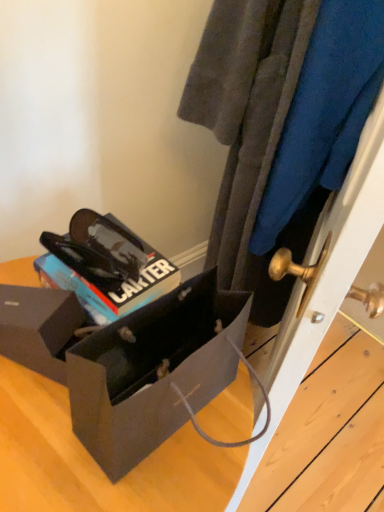
Question: In terms of size, does matte black box at lower left, which is counted as the first box, starting from the back, appear bigger or smaller than velvety blue sweater at center?

Choices:
 (A) small
 (B) big

Answer: (A)

Question: Which is correct: matte black box at lower left, positioned as the 2th box in front-to-back order, is inside velvety blue sweater at center, or outside of it?

Choices:
 (A) outside
 (B) inside

Answer: (A)

Question: Which is nearer to the glossy black sunglasses at center?

Choices:
 (A) matte black box at lower left, which is counted as the first box, starting from the back
 (B) velvety blue sweater at center
 (C) matte black box at lower left, the second box when ordered from back to front

Answer: (A)

Question: Which object is positioned closest to the matte black box at lower left, which is counted as the first box, starting from the back?

Choices:
 (A) velvety blue sweater at center
 (B) glossy black sunglasses at center
 (C) matte black box at lower left, arranged as the 1th box when viewed from the front

Answer: (B)